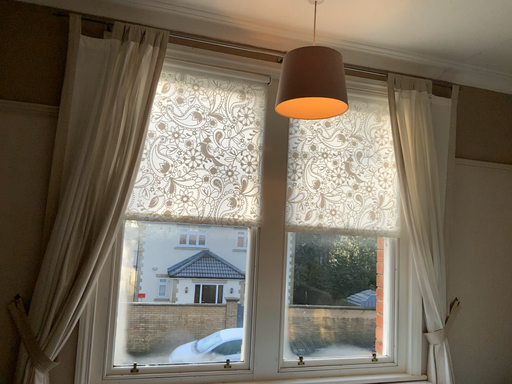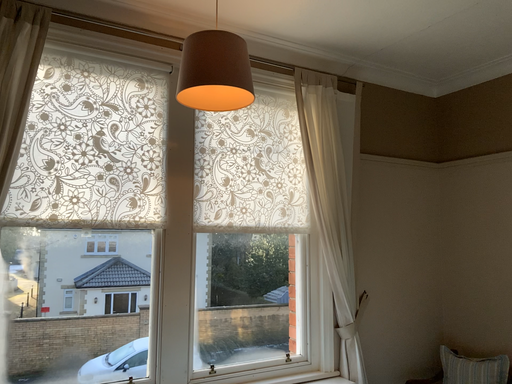
Question: Which way did the camera rotate in the video?

Choices:
 (A) rotated left
 (B) rotated right

Answer: (B)